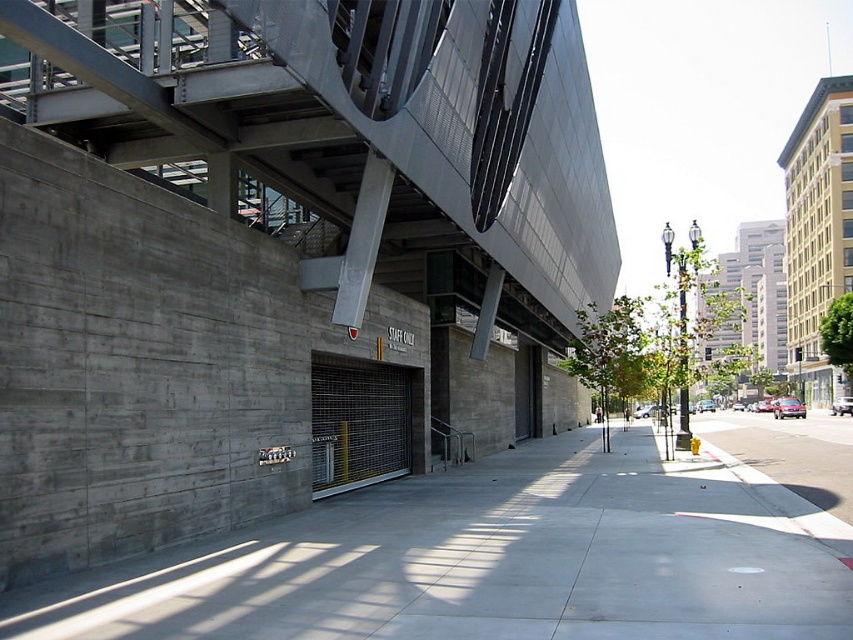
You are a delivery person trying to navigate through the street. The metallic gray overpass at center and the gray concrete sidewalk at center are both in your path. Which one is wider so you can choose the better route?

The metallic gray overpass at center is wider than the gray concrete sidewalk at center, so you should choose the metallic gray overpass at center for a better route.

You are a delivery person trying to navigate through the urban street scene. You need to deliver a package to a location marked by point (585,264) and then to another location marked by point (682,611). Since you can only move forward, which point should you reach first?

You should reach point (682,611) first because point (585,264) is behind it. Since you can only move forward, you must pass point (682,611) before reaching the point behind it.

You are a delivery person trying to navigate through the street. You see the metallic gray overpass at center and the gray concrete sidewalk at center. Which one is larger in size?

The metallic gray overpass at center is bigger than the gray concrete sidewalk at center, so the overpass is larger in size.